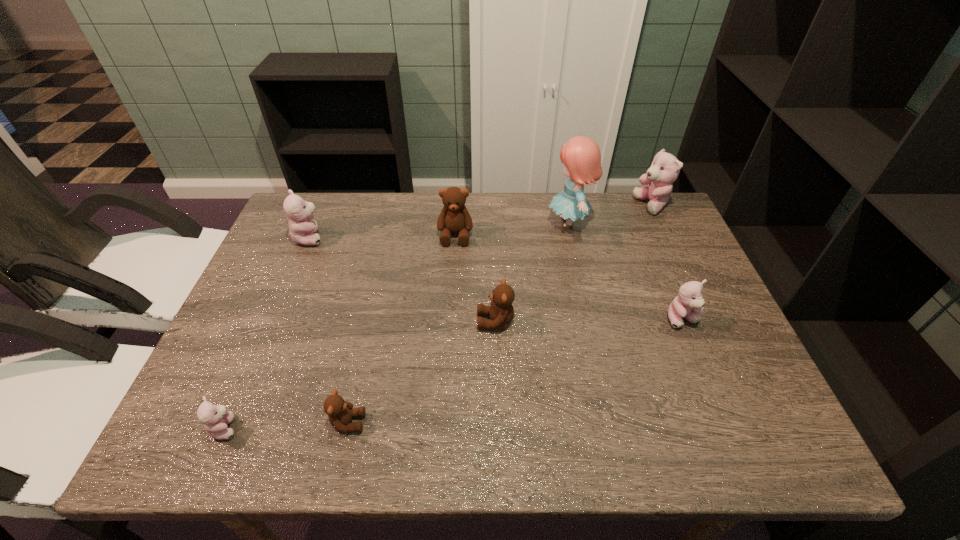
Locate an element on the screen. This screenshot has width=960, height=540. object that is positioned at the far right corner is located at coordinates (665, 168).

Locate an element on the screen. Image resolution: width=960 pixels, height=540 pixels. vacant space at the far edge of the desktop is located at coordinates (398, 205).

In the image, there is a desktop. What are the coordinates of `free space at the near edge` in the screenshot? It's located at (466, 422).

In the image, there is a desktop. Identify the location of blank space at the right edge. This screenshot has height=540, width=960. (700, 333).

The height and width of the screenshot is (540, 960). Identify the location of vacant space at the near left corner. (197, 443).

Where is `vacant region between the fifth teddy bear from left to right and the fourth teddy bear from right to left`? The image size is (960, 540). vacant region between the fifth teddy bear from left to right and the fourth teddy bear from right to left is located at coordinates (475, 279).

Locate an element on the screen. This screenshot has height=540, width=960. free spot between the nearest pink teddy bear and the third biggest pink teddy bear is located at coordinates (454, 374).

Identify the location of vacant area that lies between the doll and the biggest brown teddy bear. (512, 229).

Identify the location of blank region between the sixth object from left to right and the farthest pink teddy bear. (611, 214).

Locate an element on the screen. This screenshot has height=540, width=960. vacant space that's between the second smallest pink teddy bear and the third teddy bear from left to right is located at coordinates (516, 371).